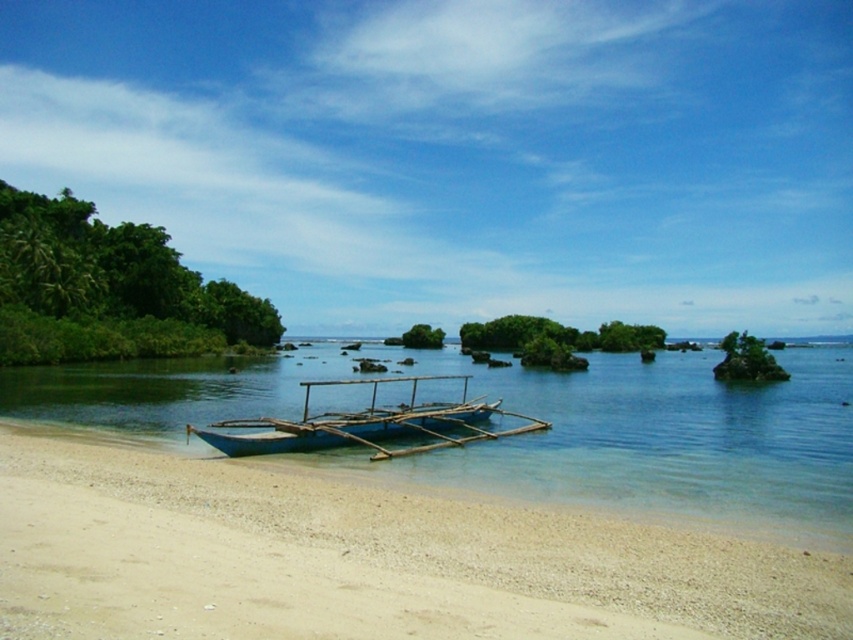
You are standing on the sandy beach and see the blue wooden water at center and the blue wooden boat at center. Which object is closer to the shore?

The blue wooden boat at center is closer to the shore because it is positioned over the blue wooden water at center, indicating it is above and nearer to the observer on the beach.

You are standing at the boat anchored near the shore and want to walk to the point marked at coordinates (364, 561). Which direction should you head to reach there?

You should head towards the lower left direction to reach the point marked at coordinates (364, 561) since it is located on the white sandy beach at lower left.